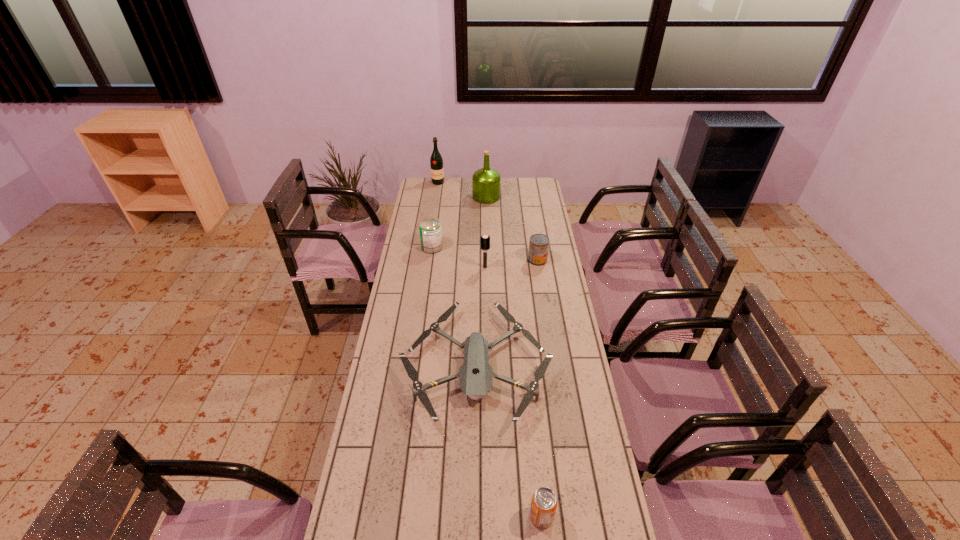
The image size is (960, 540). In order to click on liquor in this screenshot , I will do `click(436, 162)`.

Locate an element on the screen. The width and height of the screenshot is (960, 540). olive oil is located at coordinates (486, 181).

In order to click on the third tallest object in this screenshot , I will do `click(484, 239)`.

Where is `the fourth tallest object`? Image resolution: width=960 pixels, height=540 pixels. the fourth tallest object is located at coordinates (430, 229).

Find the location of a particular element. The height and width of the screenshot is (540, 960). the taller can is located at coordinates (430, 229).

Where is `the right can`? The image size is (960, 540). the right can is located at coordinates (539, 243).

The height and width of the screenshot is (540, 960). In order to click on the nearest object in this screenshot , I will do `click(543, 506)`.

Identify the location of drone. Image resolution: width=960 pixels, height=540 pixels. [x=476, y=375].

Find the location of a particular element. the shortest object is located at coordinates (476, 375).

At what (x,y) coordinates should I click in order to perform the action: click on blank space located on the front-facing side of the farthest object. Please return your answer as a coordinate pair (x, y). The width and height of the screenshot is (960, 540). Looking at the image, I should click on (436, 199).